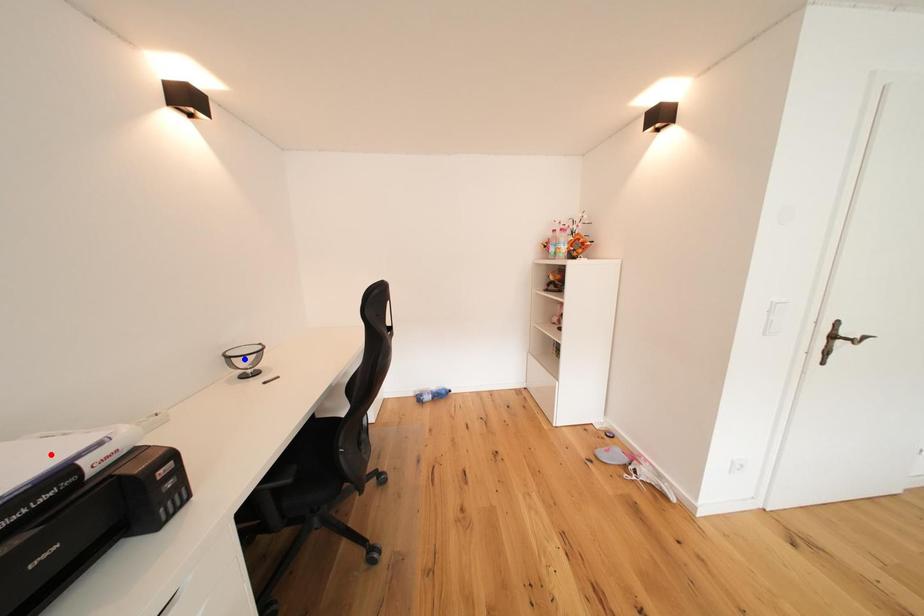
Question: In the image, two points are highlighted. Which point is nearer to the camera? Reply with the corresponding letter.

Choices:
 (A) blue point
 (B) red point

Answer: (B)